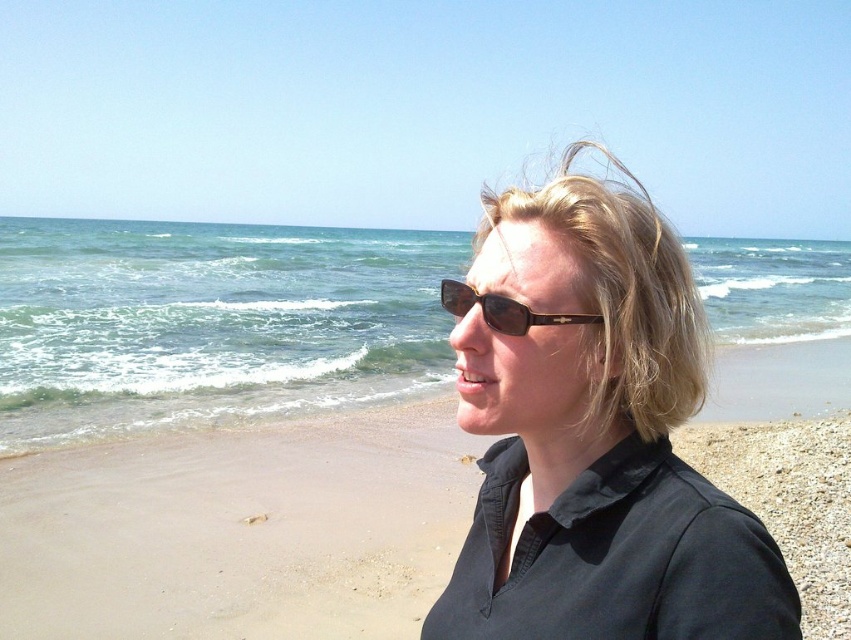
Question: Can you confirm if matte black shirt at center is positioned above sunglasses at center?

Choices:
 (A) yes
 (B) no

Answer: (B)

Question: Which point is farther from the camera taking this photo?

Choices:
 (A) (408, 481)
 (B) (443, 621)

Answer: (A)

Question: Which point is closer to the camera taking this photo?

Choices:
 (A) (538, 324)
 (B) (521, 634)
 (C) (221, 452)

Answer: (A)

Question: Does sandy beach at lower right have a smaller size compared to sunglasses at center?

Choices:
 (A) no
 (B) yes

Answer: (A)

Question: Which object is positioned farthest from the matte black shirt at center?

Choices:
 (A) sandy beach at lower right
 (B) sunglasses at center

Answer: (A)

Question: Does sandy beach at lower right appear on the left side of sunglasses at center?

Choices:
 (A) no
 (B) yes

Answer: (A)